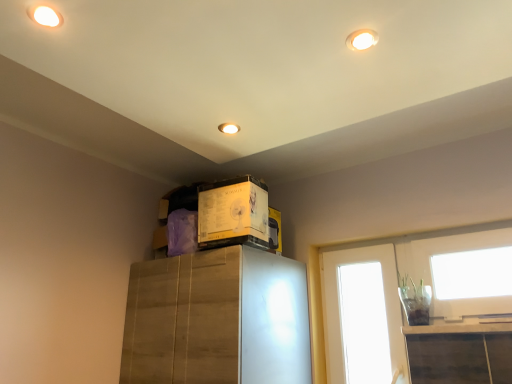
Question: Which is correct: yellow cardboard box at upper center is inside white glossy door at upper right, or outside of it?

Choices:
 (A) outside
 (B) inside

Answer: (A)

Question: Is yellow cardboard box at upper center bigger or smaller than white glossy door at upper right?

Choices:
 (A) big
 (B) small

Answer: (A)

Question: From the image's perspective, is yellow cardboard box at upper center above or below white glossy door at upper right?

Choices:
 (A) above
 (B) below

Answer: (A)

Question: Based on their positions, is white glossy door at upper right located to the left or right of yellow cardboard box at upper center?

Choices:
 (A) left
 (B) right

Answer: (B)

Question: Is white glossy door at upper right in front of or behind yellow cardboard box at upper center in the image?

Choices:
 (A) front
 (B) behind

Answer: (B)

Question: Considering the positions of point [352, 263] and point [246, 200], is point [352, 263] closer or farther from the camera than point [246, 200]?

Choices:
 (A) farther
 (B) closer

Answer: (A)

Question: In terms of width, does white glossy door at upper right look wider or thinner when compared to yellow cardboard box at upper center?

Choices:
 (A) wide
 (B) thin

Answer: (B)